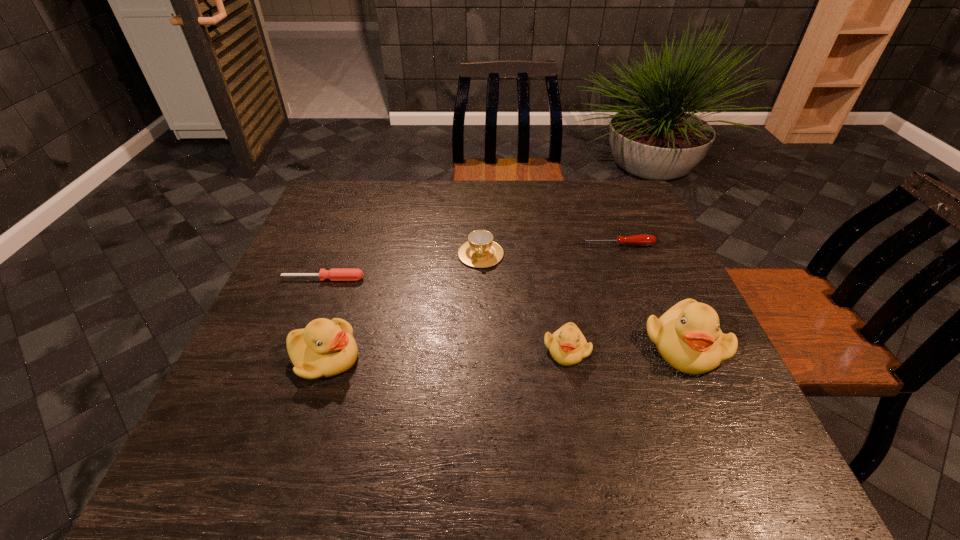
You are a GUI agent. You are given a task and a screenshot of the screen. Output one action in this format:
    pyautogui.click(x=<x>, y=<y>)
    Task: Click on the leftmost duckling
    The width and height of the screenshot is (960, 540).
    Given the screenshot: What is the action you would take?
    pyautogui.click(x=325, y=348)

Find the location of a particular element. Image resolution: width=960 pixels, height=540 pixels. the second shortest duckling is located at coordinates (325, 348).

Locate an element on the screen. the second duckling from left to right is located at coordinates (568, 346).

The width and height of the screenshot is (960, 540). In order to click on the third object from right to left in this screenshot , I will do `click(568, 346)`.

Find the location of a particular element. the rightmost duckling is located at coordinates (688, 337).

At what (x,y) coordinates should I click in order to perform the action: click on the fourth object from right to left. Please return your answer as a coordinate pair (x, y). Looking at the image, I should click on (480, 251).

This screenshot has width=960, height=540. I want to click on the fourth tallest object, so click(480, 251).

Find the location of a particular element. The image size is (960, 540). the fourth nearest object is located at coordinates (335, 274).

This screenshot has height=540, width=960. I want to click on the left screwdriver, so click(x=335, y=274).

Find the location of a particular element. The width and height of the screenshot is (960, 540). the right screwdriver is located at coordinates (641, 240).